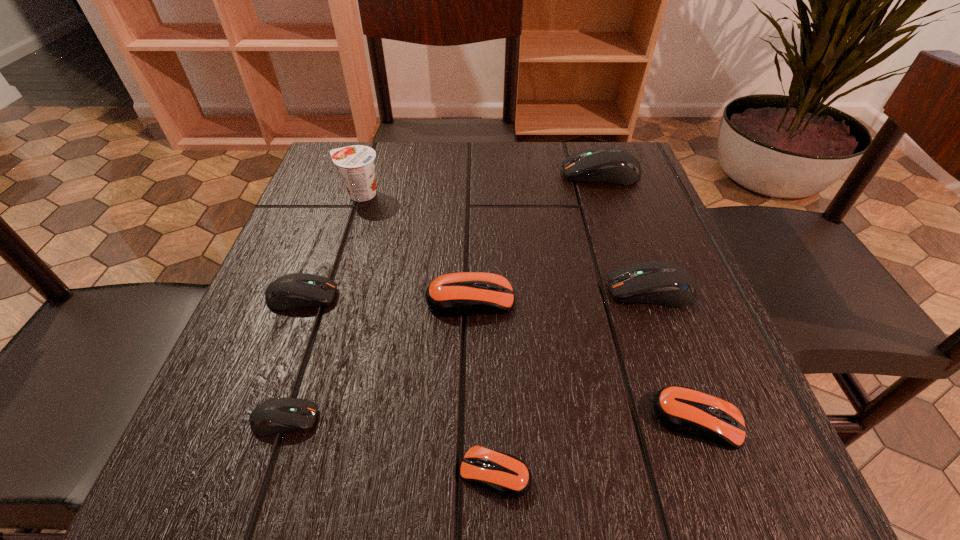
The image size is (960, 540). In order to click on free space at the far edge of the desktop in this screenshot , I will do `click(483, 157)`.

Locate an element on the screen. free space at the near edge of the desktop is located at coordinates (417, 455).

In the image, there is a desktop. Find the location of `free space at the left edge`. free space at the left edge is located at coordinates (328, 248).

This screenshot has height=540, width=960. What are the coordinates of `free space at the right edge of the desktop` in the screenshot? It's located at (616, 206).

The image size is (960, 540). I want to click on vacant space at the far left corner of the desktop, so click(379, 188).

Identify the location of vacant space at the near left corner. This screenshot has height=540, width=960. (316, 440).

Locate an element on the screen. Image resolution: width=960 pixels, height=540 pixels. free point between the yogurt and the rightmost orange computer mouse is located at coordinates (529, 307).

What are the coordinates of `free space between the smallest dark computer equipment and the smallest orange computer mouse` in the screenshot? It's located at (390, 446).

Find the location of a particular element. The height and width of the screenshot is (540, 960). unoccupied position between the biggest orange computer mouse and the smallest dark computer equipment is located at coordinates (377, 359).

Where is `blank region between the third biggest dark computer equipment and the yogurt`? The image size is (960, 540). blank region between the third biggest dark computer equipment and the yogurt is located at coordinates (331, 245).